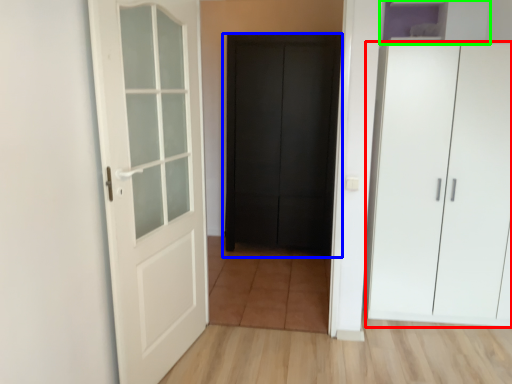
Question: Which object is positioned closest to cupboard (highlighted by a red box)? Select from door (highlighted by a blue box) and cabinetry (highlighted by a green box).

Choices:
 (A) door
 (B) cabinetry

Answer: (B)